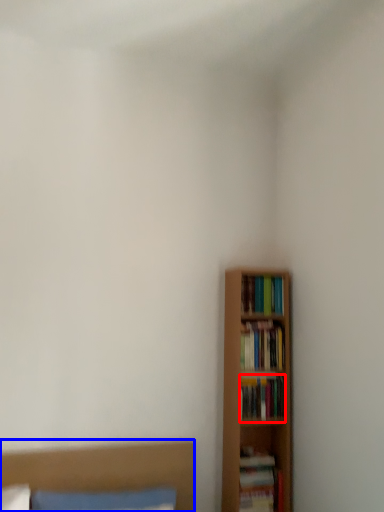
Question: Which point is further to the camera, book (highlighted by a red box) or bed (highlighted by a blue box)?

Choices:
 (A) book
 (B) bed

Answer: (A)